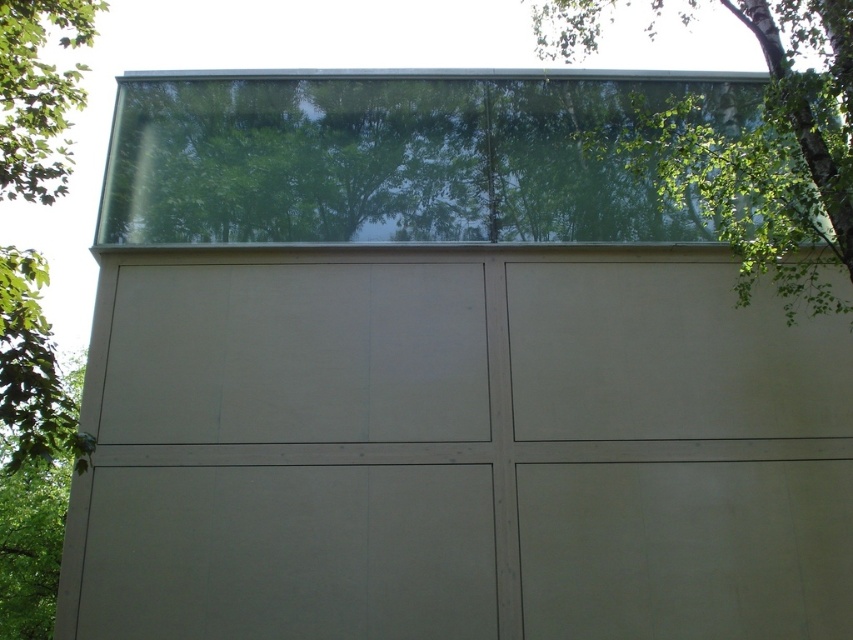
You are standing outside the building and want to take a photo of the transparent glass window at upper center. According to the coordinates provided, where should you aim your camera to capture it?

You should aim your camera at point 0.245 on the horizontal axis and 0.469 on the vertical axis to capture the transparent glass window at upper center.

You are standing outside the building and want to enter through the entrance. Which object should you look for first, the matte beige garage door at center or the transparent glass window at upper center?

You should look for the matte beige garage door at center first because it is located below the transparent glass window at upper center, making it closer to the ground level where the entrance would typically be situated.